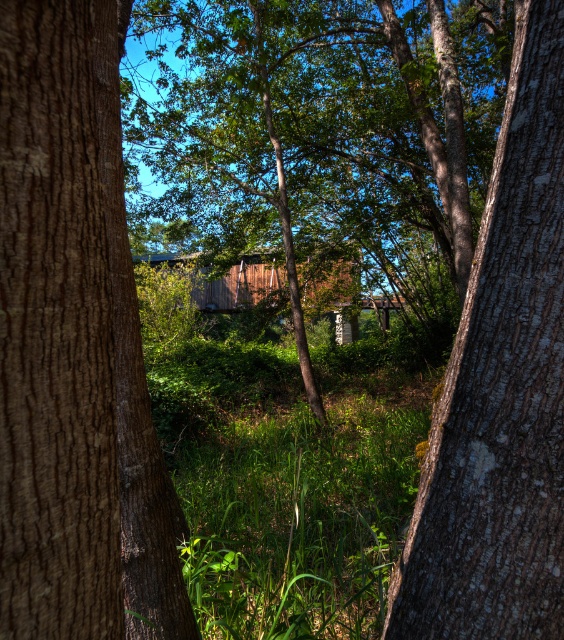
Question: Can you confirm if brown rough bark tree trunk at left is thinner than smooth bark tree trunk at center?

Choices:
 (A) yes
 (B) no

Answer: (A)

Question: Can you confirm if brown rough bark tree trunk at left is positioned to the left of smooth bark tree trunk at center?

Choices:
 (A) no
 (B) yes

Answer: (B)

Question: Which of the following is the closest to the observer?

Choices:
 (A) (90, 22)
 (B) (468, 595)

Answer: (A)

Question: Is brown rough bark tree trunk at left to the left of smooth bark tree trunk at center from the viewer's perspective?

Choices:
 (A) no
 (B) yes

Answer: (B)

Question: Which object is farther from the camera taking this photo?

Choices:
 (A) brown rough bark tree trunk at left
 (B) smooth bark tree trunk at center

Answer: (A)